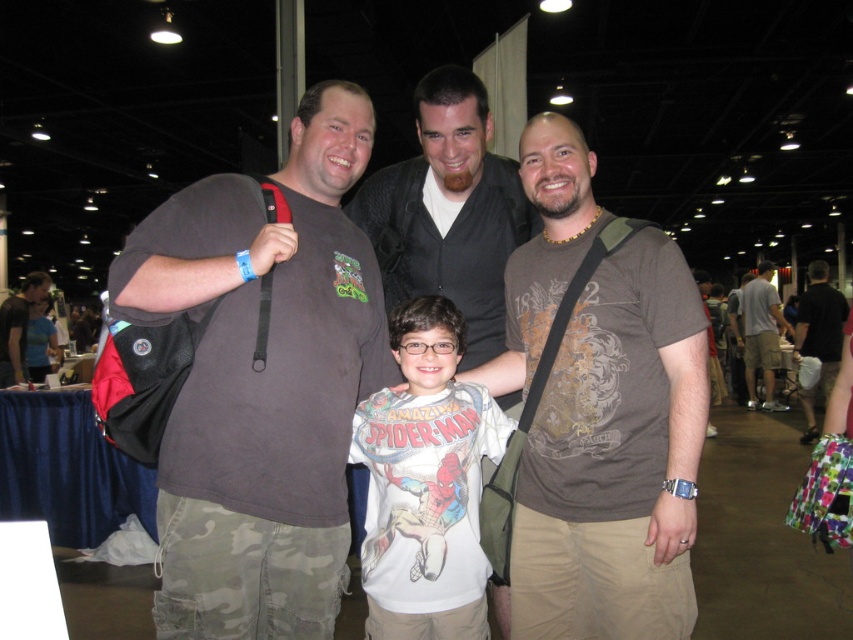
Can you confirm if dark gray t-shirt at left is positioned below light brown cotton t-shirt at center?

Incorrect, dark gray t-shirt at left is not positioned below light brown cotton t-shirt at center.

Does dark gray t-shirt at left come behind light brown cotton t-shirt at center?

That is False.

Locate an element on the screen. The height and width of the screenshot is (640, 853). dark gray t-shirt at left is located at coordinates click(x=262, y=381).

Find the location of a particular element. dark gray t-shirt at left is located at coordinates (262, 381).

Between dark brown leather jacket at center and light brown cotton t-shirt at center, which one has more height?

light brown cotton t-shirt at center is taller.

Looking at this image, can you confirm if dark brown leather jacket at center is shorter than light brown cotton t-shirt at center?

Yes, dark brown leather jacket at center is shorter than light brown cotton t-shirt at center.

Is point (466, 77) positioned in front of point (752, 337)?

Yes.

Locate an element on the screen. The image size is (853, 640). dark brown leather jacket at center is located at coordinates (448, 211).

Can you confirm if brown cotton t-shirt at center is thinner than white cotton t-shirt at center?

No.

The image size is (853, 640). What do you see at coordinates (614, 460) in the screenshot? I see `brown cotton t-shirt at center` at bounding box center [614, 460].

The height and width of the screenshot is (640, 853). I want to click on brown cotton t-shirt at center, so click(x=614, y=460).